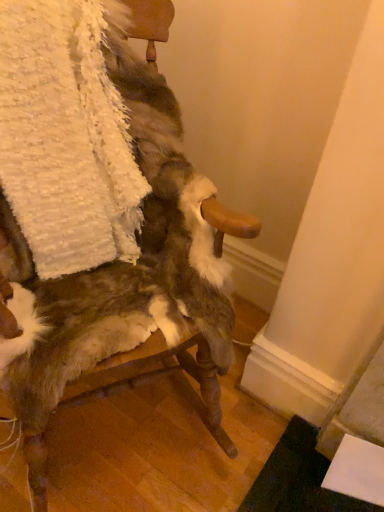
What do you see at coordinates (181, 219) in the screenshot? The height and width of the screenshot is (512, 384). I see `fur-covered chair at center` at bounding box center [181, 219].

Where is `fur-covered chair at center`? The image size is (384, 512). fur-covered chair at center is located at coordinates (181, 219).

The image size is (384, 512). Identify the location of fur-covered chair at center. (181, 219).